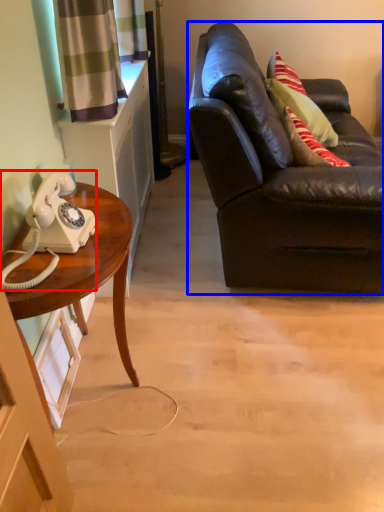
Question: Which point is closer to the camera, corded phone (highlighted by a red box) or studio couch (highlighted by a blue box)?

Choices:
 (A) corded phone
 (B) studio couch

Answer: (A)